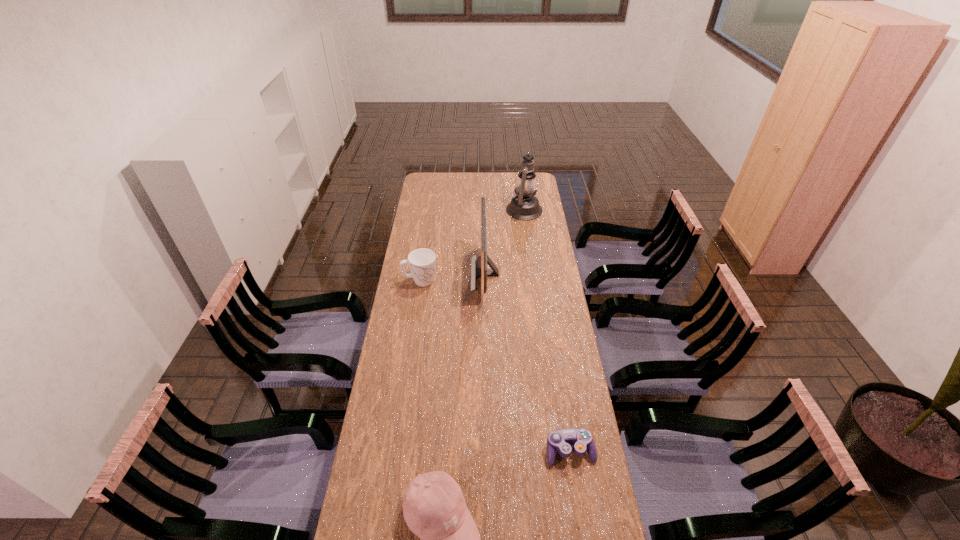
Locate an element on the screen. This screenshot has width=960, height=540. the tallest object is located at coordinates (524, 205).

The image size is (960, 540). In order to click on the farthest object in this screenshot , I will do `click(524, 205)`.

Where is `the second tallest object`? The height and width of the screenshot is (540, 960). the second tallest object is located at coordinates (483, 272).

What are the coordinates of `mug` in the screenshot? It's located at (422, 262).

Identify the location of control. Image resolution: width=960 pixels, height=540 pixels. pyautogui.click(x=560, y=440).

Identify the location of the second nearest object. (560, 440).

The width and height of the screenshot is (960, 540). In order to click on vacant area situated 0.250m on the back of the farthest object in this screenshot , I will do `click(517, 178)`.

This screenshot has width=960, height=540. What are the coordinates of `vacant space located on the screen side of the fourth shortest object` in the screenshot? It's located at (438, 274).

Image resolution: width=960 pixels, height=540 pixels. Identify the location of blank area located on the screen side of the fourth shortest object. (412, 274).

Image resolution: width=960 pixels, height=540 pixels. I want to click on blank space located 0.070m on the screen side of the fourth shortest object, so click(x=456, y=274).